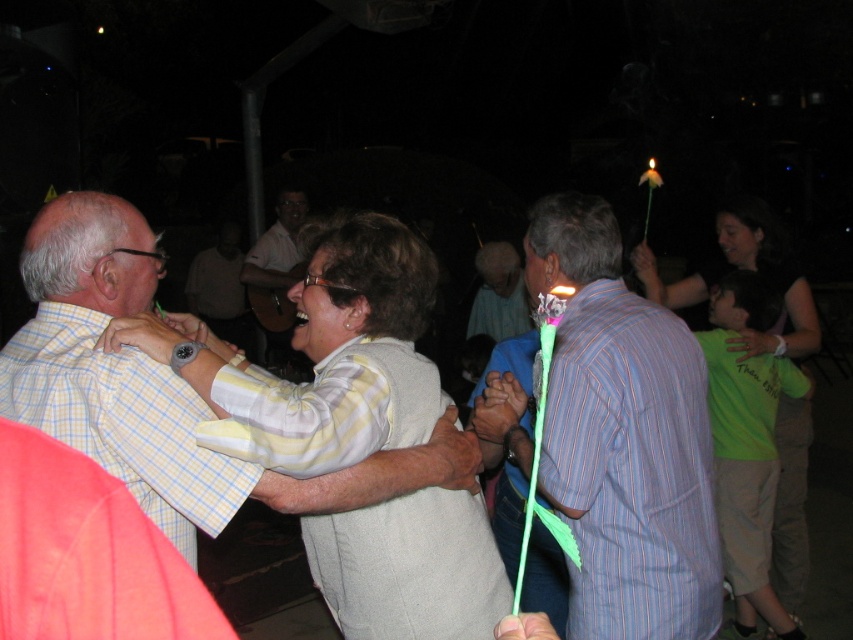
You are at a party and want to take a photo of the two points in the scene. The first point is at coordinates point (248, 256) and the second is at point (498, 262). Which point is closer to you when you take the photo?

Point (248, 256) is closer to you because it is further to the viewer than point (498, 262).

You are at a party and want to place a new decoration between the green plastic candle at right and the light blue striped shirt at center. Based on their positions, where should you place the decoration?

The green plastic candle at right is below the light blue striped shirt at center, so you should place the decoration between them in the vertical space between the two objects.